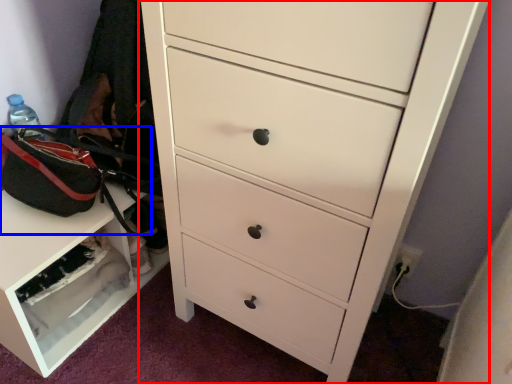
Question: Which point is closer to the camera, chest of drawers (highlighted by a red box) or messenger bag (highlighted by a blue box)?

Choices:
 (A) chest of drawers
 (B) messenger bag

Answer: (A)